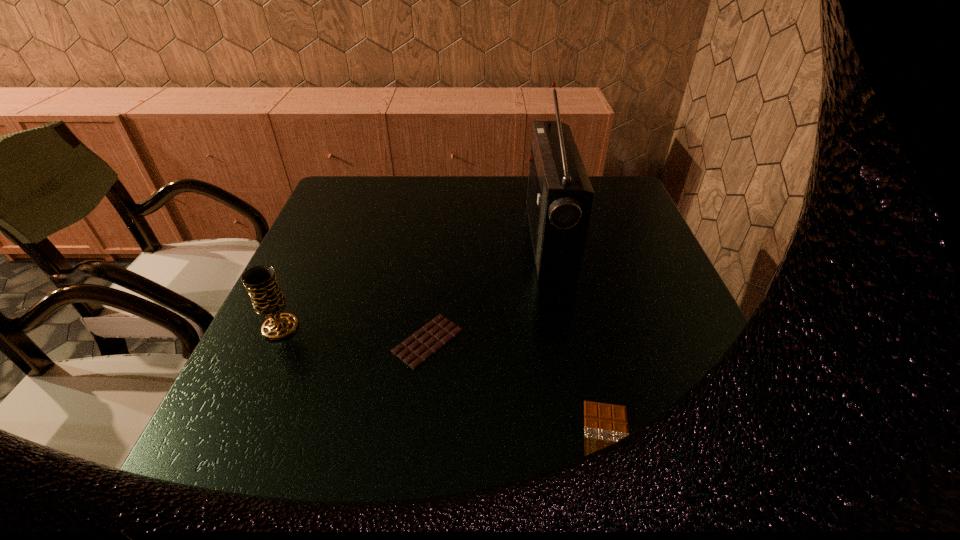
At what (x,y) coordinates should I click in order to perform the action: click on empty location between the third tallest object and the chalice. Please return your answer as a coordinate pair (x, y). Looking at the image, I should click on (354, 334).

Where is `vacant region between the radio receiver and the third object from right to left`? This screenshot has height=540, width=960. vacant region between the radio receiver and the third object from right to left is located at coordinates (489, 291).

The width and height of the screenshot is (960, 540). In order to click on vacant area that lies between the shorter chocolate bar and the farthest object in this screenshot , I will do `click(578, 344)`.

Identify the location of the closest object relative to the tallest object. Image resolution: width=960 pixels, height=540 pixels. (420, 346).

Identify which object is the second nearest to the farthest object. Please provide its 2D coordinates. Your answer should be formatted as a tuple, i.e. [(x, y)], where the tuple contains the x and y coordinates of a point satisfying the conditions above.

[(604, 424)]

Identify the location of vacant region that satisfies the following two spatial constraints: 1. on the front-facing side of the right chocolate bar; 2. on the right side of the radio receiver. (590, 449).

At what (x,y) coordinates should I click in order to perform the action: click on free space that satisfies the following two spatial constraints: 1. on the front-facing side of the radio receiver; 2. on the front side of the left chocolate bar. Please return your answer as a coordinate pair (x, y). Looking at the image, I should click on (568, 341).

Locate an element on the screen. The height and width of the screenshot is (540, 960). free space that satisfies the following two spatial constraints: 1. on the front-facing side of the shortest object; 2. on the right side of the tallest object is located at coordinates (590, 449).

The width and height of the screenshot is (960, 540). I want to click on vacant area that satisfies the following two spatial constraints: 1. on the front-facing side of the farthest object; 2. on the front side of the third shortest object, so click(x=566, y=328).